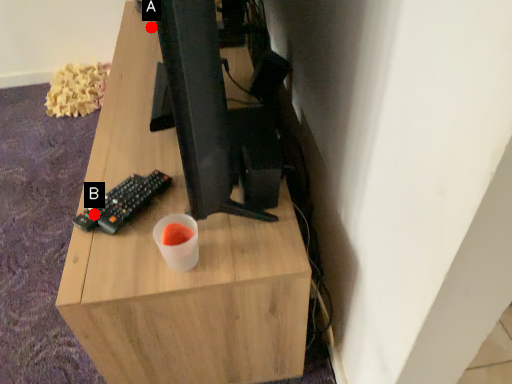
Question: Two points are circled on the image, labeled by A and B beside each circle. Which point is closer to the camera?

Choices:
 (A) A is closer
 (B) B is closer

Answer: (B)